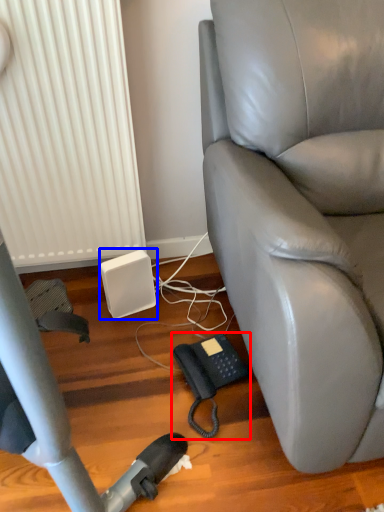
Question: Which of the following is the closest to the observer, corded phone (highlighted by a red box) or speaker (highlighted by a blue box)?

Choices:
 (A) corded phone
 (B) speaker

Answer: (A)